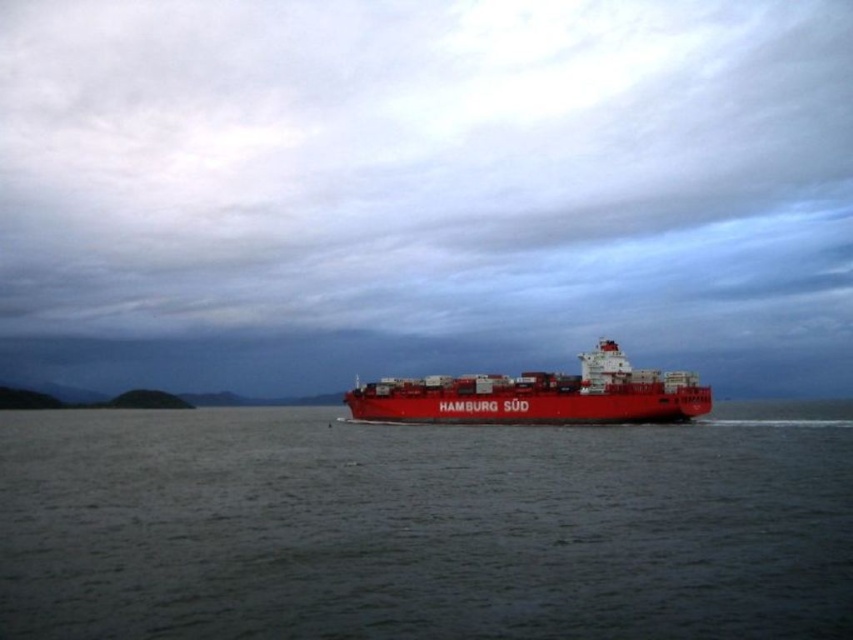
Can you confirm if dark gray water at center is smaller than matte red container ship at center?

Yes, dark gray water at center is smaller than matte red container ship at center.

Is dark gray water at center closer to the viewer compared to matte red container ship at center?

Yes, it is.

Who is more distant from viewer, (467,538) or (561,396)?

Point (561,396)

What are the coordinates of `dark gray water at center` in the screenshot? It's located at (424, 528).